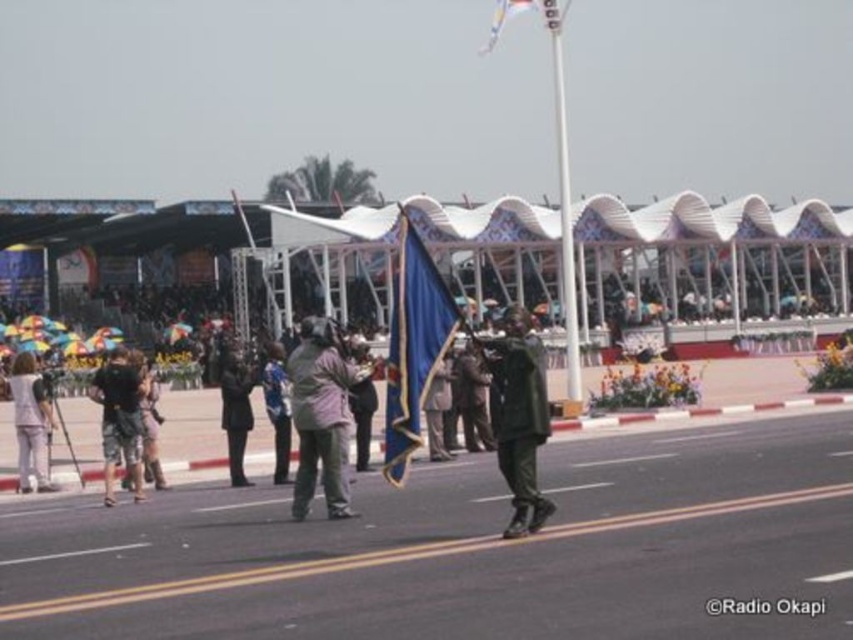
You are a photographer at the event and need to position yourself to capture both the dark green camouflage pants at center and the white cotton pants at lower left in the same frame. Which object should you focus on first to ensure both are in the shot?

You should focus on the dark green camouflage pants at center first because it is located below the white cotton pants at lower left, so adjusting the camera angle downward will include both objects in the frame.

You are a photographer at the event and need to capture both the dark green camouflage pants at center and the white cotton pants at lower left in your shot. Which pair of pants will appear larger in your photo?

The dark green camouflage pants at center will appear larger in the photo because they have a greater height compared to the white cotton pants at lower left.

You are a photographer at the event and need to position your camera to capture both the white metallic pole at upper center and the dark blue fabric at center in the same frame. Which object should you adjust your camera angle to focus on first to ensure both are visible?

The white metallic pole at upper center is wider than the dark blue fabric at center, so you should focus on the white metallic pole at upper center first to ensure both objects are visible in the frame.